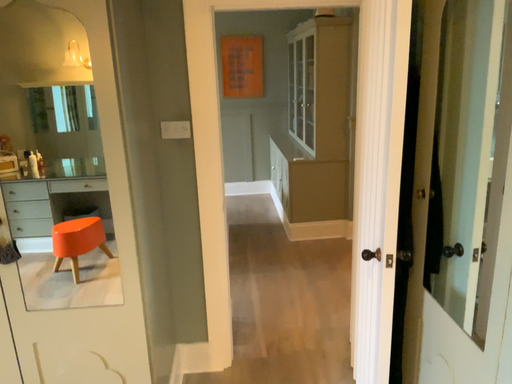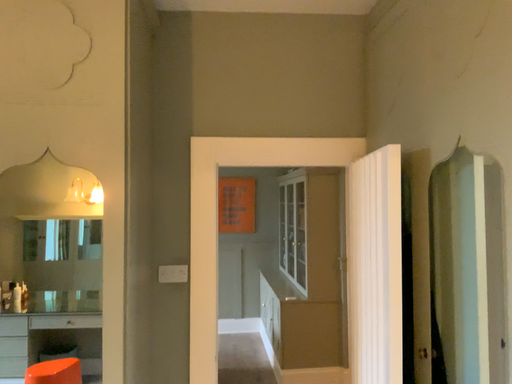
Question: Which way did the camera rotate in the video?

Choices:
 (A) rotated upward
 (B) rotated downward

Answer: (A)